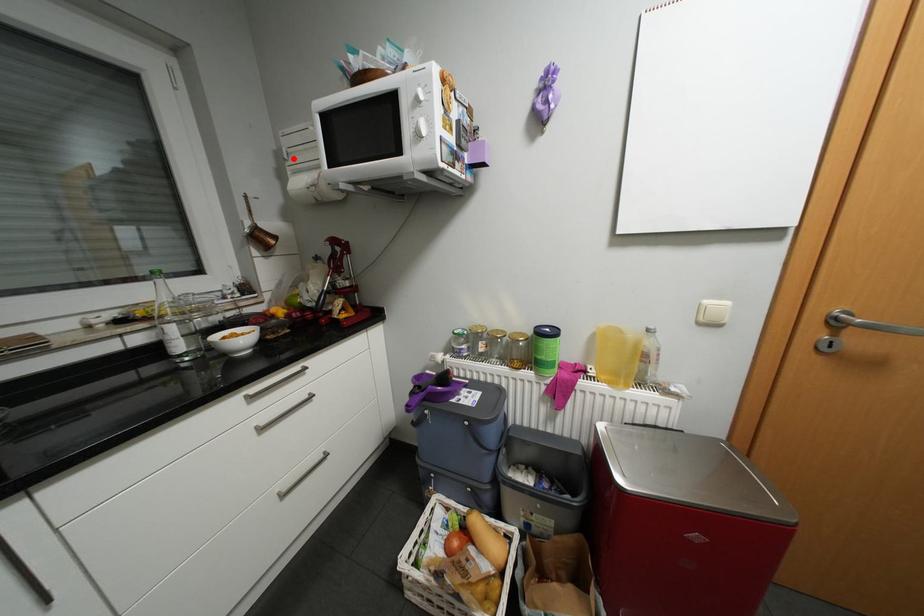
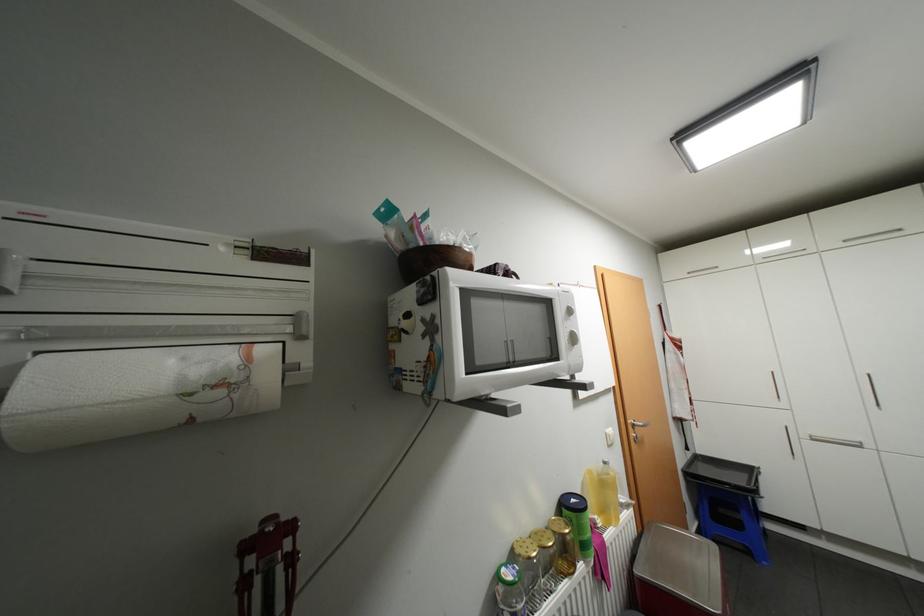
Find the pixel in the second image that matches the highlighted location in the first image.

(6, 291)